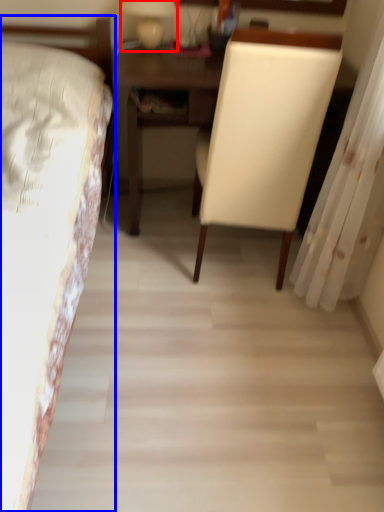
Question: Among these objects, which one is farthest to the camera, bedside lamp (highlighted by a red box) or bed (highlighted by a blue box)?

Choices:
 (A) bedside lamp
 (B) bed

Answer: (A)